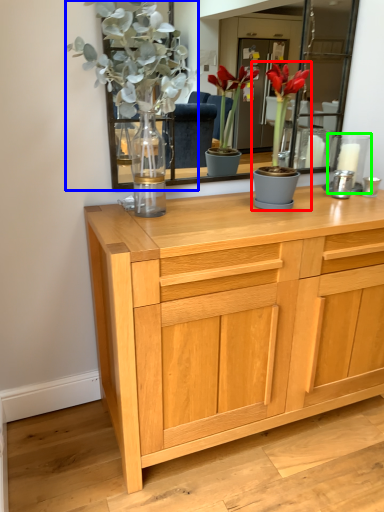
Question: Which object is positioned farthest from houseplant (highlighted by a red box)? Select from floral arrangement (highlighted by a blue box) and candle holder (highlighted by a green box).

Choices:
 (A) floral arrangement
 (B) candle holder

Answer: (A)